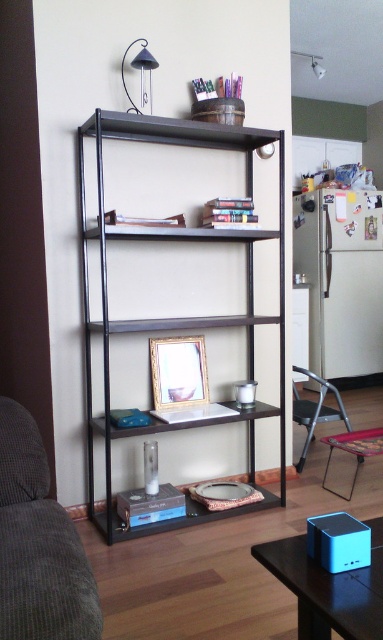
You are standing in the living space and want to place a new decorative item on the shelf closest to the blue plastic speaker at lower right. Based on its current position, which shelf should you choose?

The blue plastic speaker at lower right is located at point (328, 588), so the closest shelf would be the top shelf since it is the highest point on the shelving unit.

You are sitting on the gray corduroy couch at lower left and want to reach the metallic gray chair at lower right. According to the scene description, which direction should you move to get there?

The gray corduroy couch at lower left is above the metallic gray chair at lower right, so you should move downward to reach it.

You are standing in the living room and want to move from the point at coordinates (274, 557) to the refrigerator. The path between them is 1.34 meters. If your cleaning robot is 1.2 meters wide, can it fit through the space?

The path between the point at coordinates (274, 557) and the refrigerator is 1.34 meters. Since the robot is 1.2 meters wide, it can fit through the space as it is wider than the robot.